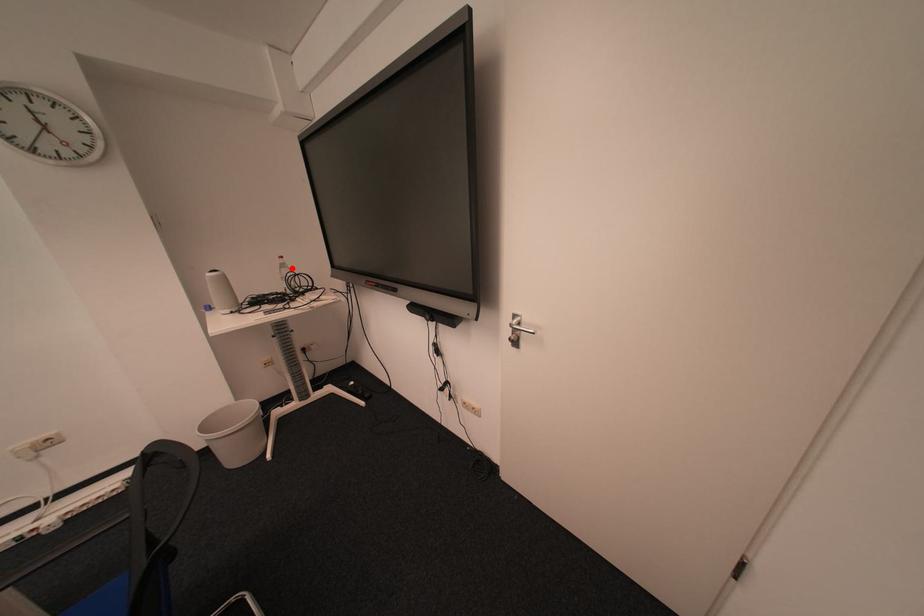
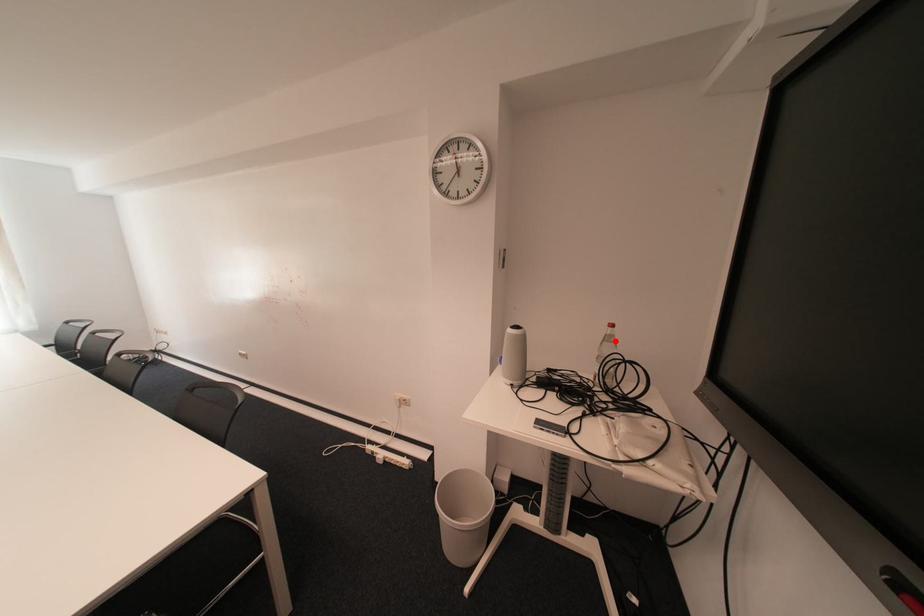
I am providing you with two images of the same scene from different viewpoints. A red point is marked on the first image and another point is marked on the second image. Are the points marked in image1 and image2 representing the same 3D position?

Yes